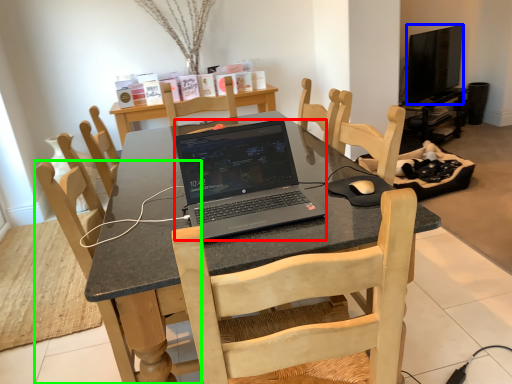
Question: Which object is the closest to the laptop (highlighted by a red box)? Choose among these: television (highlighted by a blue box) or chair (highlighted by a green box).

Choices:
 (A) television
 (B) chair

Answer: (B)